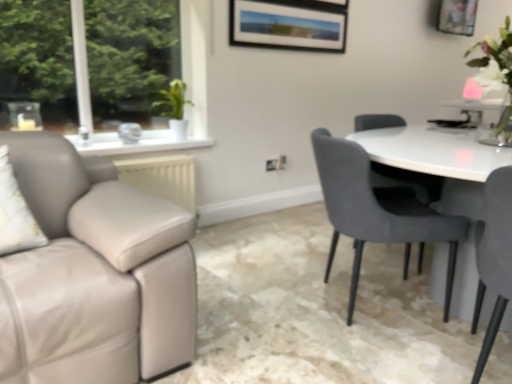
You are a GUI agent. You are given a task and a screenshot of the screen. Output one action in this format:
    pyautogui.click(x=<x>, y=<y>)
    Task: Click on the free space that is to the left of velvet grey chair at right, which is the 2th chair from front to back
    
    Given the screenshot: What is the action you would take?
    pyautogui.click(x=254, y=307)